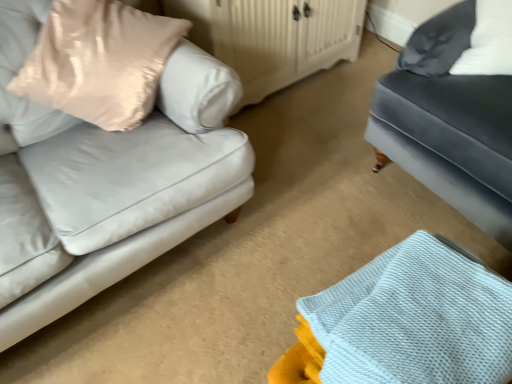
Question: From a real-world perspective, does white wood dresser at center sit lower than matte gray couch at right?

Choices:
 (A) no
 (B) yes

Answer: (B)

Question: Can we say white wood dresser at center lies outside matte gray couch at right?

Choices:
 (A) yes
 (B) no

Answer: (A)

Question: Is white wood dresser at center facing towards matte gray couch at right?

Choices:
 (A) no
 (B) yes

Answer: (B)

Question: Does white wood dresser at center have a lesser width compared to matte gray couch at right?

Choices:
 (A) no
 (B) yes

Answer: (B)

Question: From the image's perspective, is white wood dresser at center located beneath matte gray couch at right?

Choices:
 (A) no
 (B) yes

Answer: (A)

Question: Does white wood dresser at center have a larger size compared to matte gray couch at right?

Choices:
 (A) no
 (B) yes

Answer: (A)

Question: Considering the relative sizes of satin beige pillow at left and white textured fabric at lower right in the image provided, is satin beige pillow at left wider than white textured fabric at lower right?

Choices:
 (A) no
 (B) yes

Answer: (A)

Question: Is satin beige pillow at left in contact with white textured fabric at lower right?

Choices:
 (A) no
 (B) yes

Answer: (A)

Question: Can you confirm if satin beige pillow at left is positioned to the left of white textured fabric at lower right?

Choices:
 (A) no
 (B) yes

Answer: (B)

Question: From a real-world perspective, is satin beige pillow at left located higher than white textured fabric at lower right?

Choices:
 (A) no
 (B) yes

Answer: (B)

Question: Is satin beige pillow at left thinner than white textured fabric at lower right?

Choices:
 (A) yes
 (B) no

Answer: (A)

Question: Is satin beige pillow at left facing towards white textured fabric at lower right?

Choices:
 (A) no
 (B) yes

Answer: (A)

Question: From the image's perspective, does white wood dresser at center appear lower than white textured fabric at lower right?

Choices:
 (A) yes
 (B) no

Answer: (B)